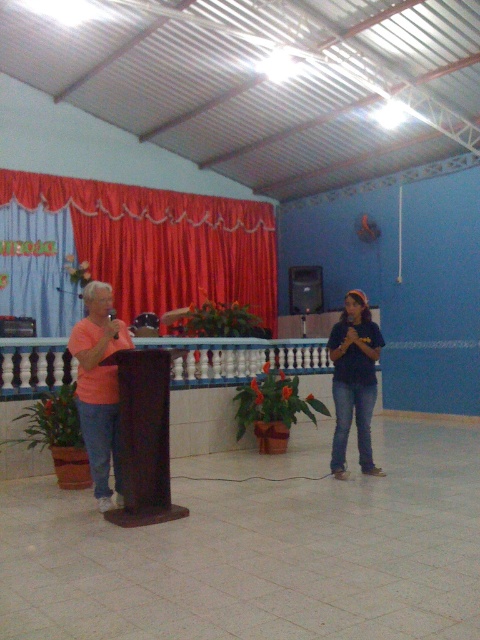
Between point (166, 230) and point (132, 444), which one is positioned behind?

Positioned behind is point (166, 230).

Can you confirm if red velvet curtain at upper left is wider than brown polished wood podium at center?

Indeed, red velvet curtain at upper left has a greater width compared to brown polished wood podium at center.

What do you see at coordinates (162, 241) in the screenshot? The height and width of the screenshot is (640, 480). I see `red velvet curtain at upper left` at bounding box center [162, 241].

Identify the location of red velvet curtain at upper left. (162, 241).

Does point (108, 513) come in front of point (337, 416)?

Yes, it is in front of point (337, 416).

Consider the image. Does brown polished wood podium at center appear on the left side of blue cotton shirt at center?

Indeed, brown polished wood podium at center is positioned on the left side of blue cotton shirt at center.

What do you see at coordinates (144, 436) in the screenshot?
I see `brown polished wood podium at center` at bounding box center [144, 436].

This screenshot has width=480, height=640. Find the location of `brown polished wood podium at center`. brown polished wood podium at center is located at coordinates (144, 436).

Does red velvet curtain at upper left have a larger size compared to blue cotton shirt at center?

Yes, red velvet curtain at upper left is bigger than blue cotton shirt at center.

Does red velvet curtain at upper left have a lesser height compared to blue cotton shirt at center?

No.

Find the location of a particular element. The height and width of the screenshot is (640, 480). red velvet curtain at upper left is located at coordinates (162, 241).